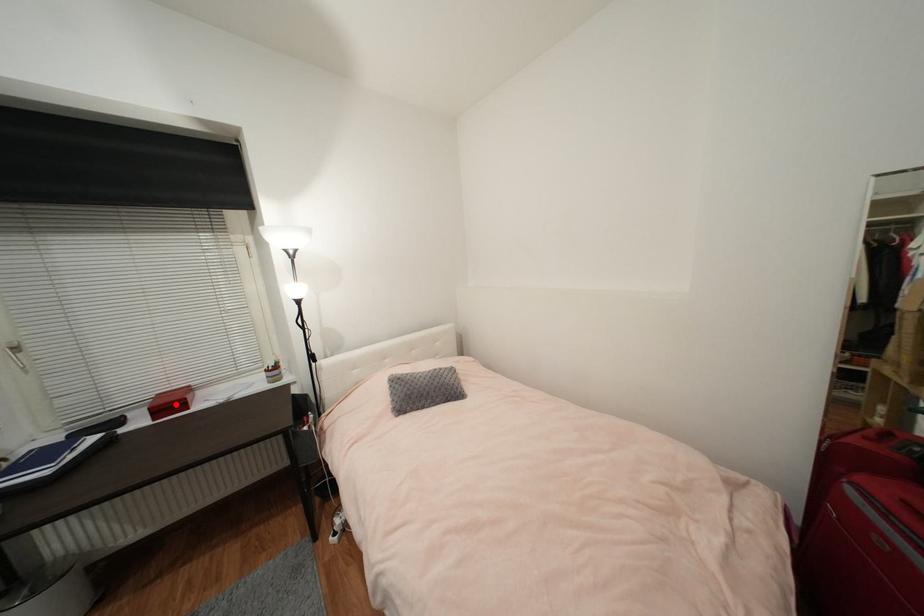
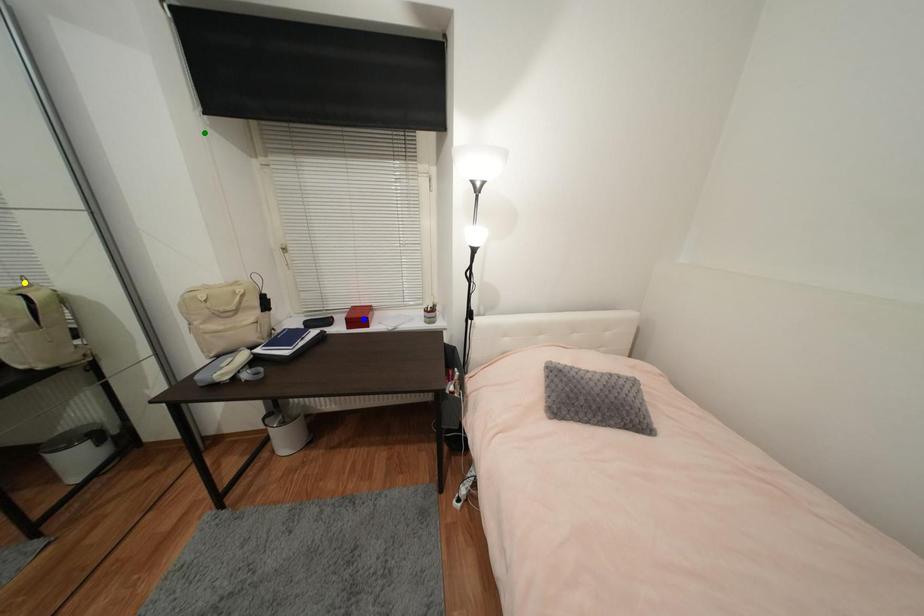
Question: I am providing you with two images of the same scene from different viewpoints. A red point is marked on the first image. You are given multiple points on the second image. Which point in image 2 represents the same 3d spot as the red point in image 1?

Choices:
 (A) yellow point
 (B) green point
 (C) blue point

Answer: (C)